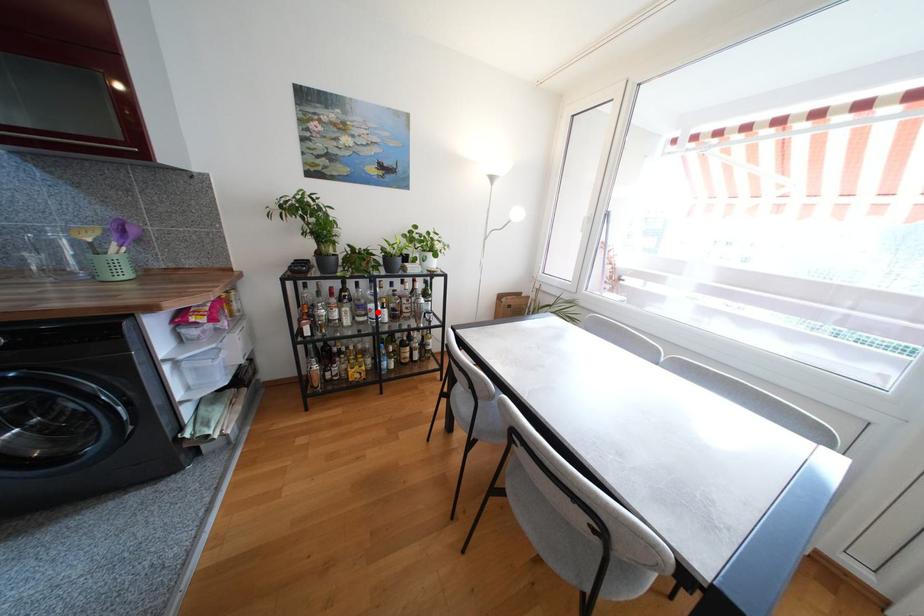
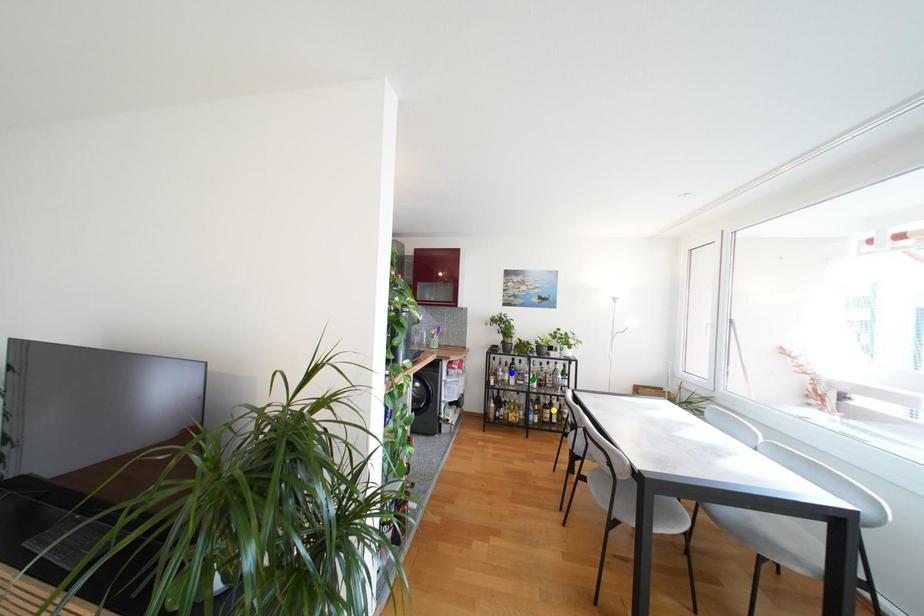
Question: I am providing you with two images of the same scene from different viewpoints. A red point is marked on the first image. You are given multiple points on the second image. Which point in image 2 represents the same 3d spot as the red point in image 1?

Choices:
 (A) green point
 (B) yellow point
 (C) blue point

Answer: (A)